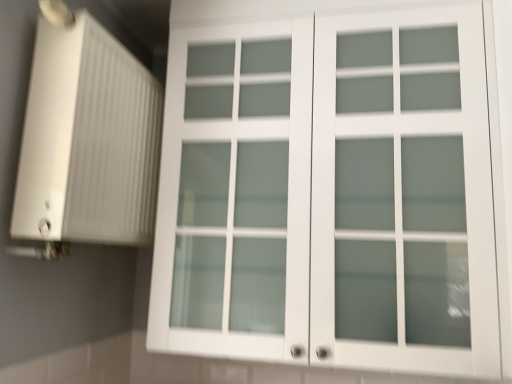
Question: From a real-world perspective, is white ribbed plastic at left on white matte cabinet at upper center?

Choices:
 (A) no
 (B) yes

Answer: (B)

Question: Is white ribbed plastic at left positioned before white matte cabinet at upper center?

Choices:
 (A) no
 (B) yes

Answer: (B)

Question: Is white ribbed plastic at left positioned beyond the bounds of white matte cabinet at upper center?

Choices:
 (A) yes
 (B) no

Answer: (A)

Question: Is white ribbed plastic at left wider than white matte cabinet at upper center?

Choices:
 (A) yes
 (B) no

Answer: (B)

Question: Is white ribbed plastic at left in contact with white matte cabinet at upper center?

Choices:
 (A) yes
 (B) no

Answer: (B)

Question: Are white ribbed plastic at left and white matte cabinet at upper center located far from each other?

Choices:
 (A) no
 (B) yes

Answer: (A)

Question: Is white matte cabinet at upper center positioned in front of white ribbed plastic at left?

Choices:
 (A) no
 (B) yes

Answer: (A)

Question: Considering the relative sizes of white matte cabinet at upper center and white ribbed plastic at left in the image provided, is white matte cabinet at upper center bigger than white ribbed plastic at left?

Choices:
 (A) no
 (B) yes

Answer: (B)

Question: Can you confirm if white matte cabinet at upper center is thinner than white ribbed plastic at left?

Choices:
 (A) no
 (B) yes

Answer: (A)

Question: Is white matte cabinet at upper center further to camera compared to white ribbed plastic at left?

Choices:
 (A) no
 (B) yes

Answer: (B)

Question: Is white matte cabinet at upper center not close to white ribbed plastic at left?

Choices:
 (A) no
 (B) yes

Answer: (A)

Question: Does white matte cabinet at upper center have a lesser height compared to white ribbed plastic at left?

Choices:
 (A) yes
 (B) no

Answer: (B)

Question: Considering their positions, is white matte cabinet at upper center located in front of or behind white ribbed plastic at left?

Choices:
 (A) front
 (B) behind

Answer: (B)